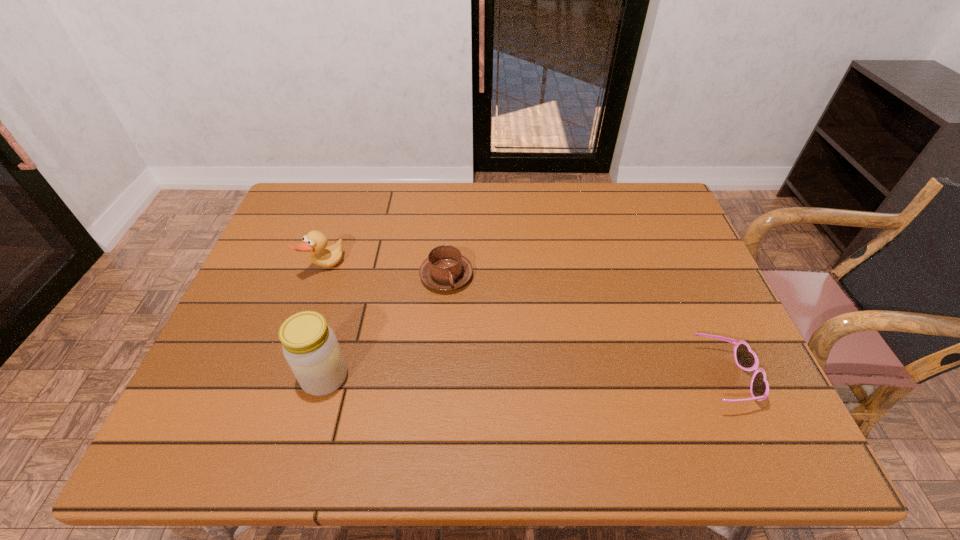
The image size is (960, 540). In the image, there is a desktop. Find the location of `vacant space at the right edge`. vacant space at the right edge is located at coordinates pyautogui.click(x=694, y=288).

In the image, there is a desktop. Identify the location of blank space at the far left corner. The image size is (960, 540). (306, 219).

The height and width of the screenshot is (540, 960). In the image, there is a desktop. In order to click on vacant space at the far right corner in this screenshot , I will do `click(668, 214)`.

Locate an element on the screen. This screenshot has width=960, height=540. free space between the second object from right to left and the shortest object is located at coordinates pyautogui.click(x=586, y=327).

Where is `vacant space that is in between the shortest object and the second tallest object`? Image resolution: width=960 pixels, height=540 pixels. vacant space that is in between the shortest object and the second tallest object is located at coordinates pos(524,323).

Image resolution: width=960 pixels, height=540 pixels. In order to click on vacant area between the cappuccino and the third shortest object in this screenshot , I will do `click(385, 272)`.

This screenshot has height=540, width=960. Find the location of `unoccupied area between the second tallest object and the sunglasses`. unoccupied area between the second tallest object and the sunglasses is located at coordinates (524, 323).

I want to click on blank region between the tallest object and the cappuccino, so click(x=386, y=327).

The image size is (960, 540). I want to click on free spot between the cappuccino and the jar, so click(386, 327).

Locate an element on the screen. Image resolution: width=960 pixels, height=540 pixels. free area in between the second shortest object and the jar is located at coordinates (386, 327).